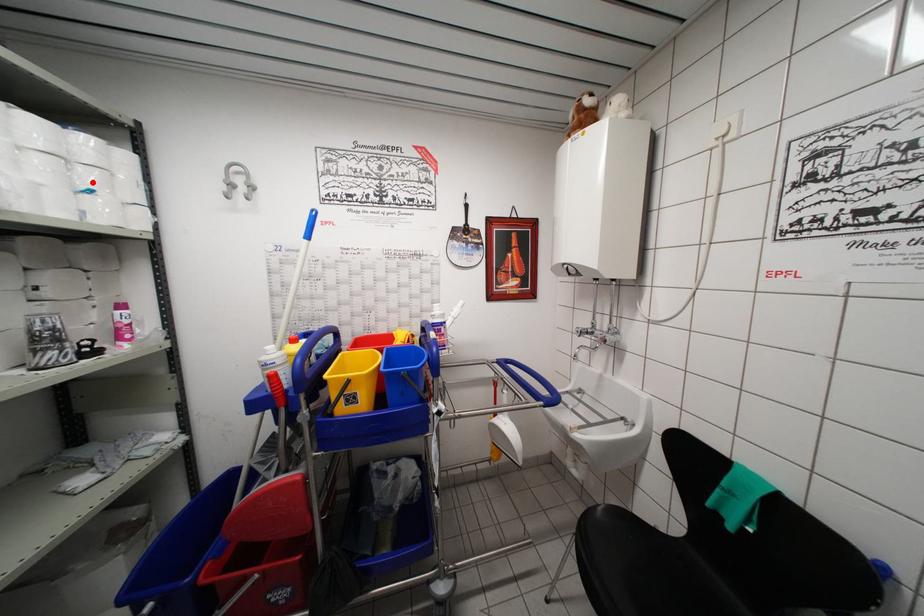
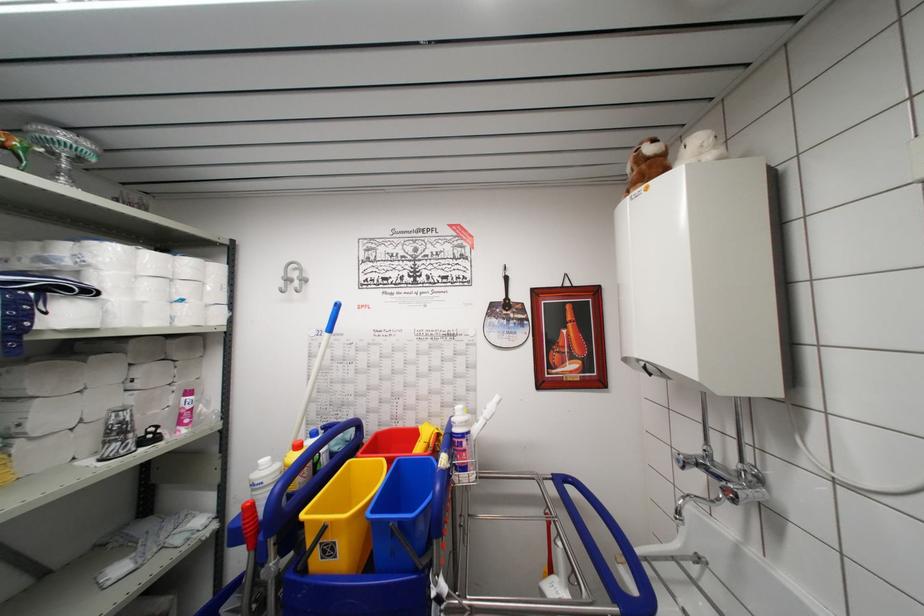
The point at the highlighted location is marked in the first image. Where is the corresponding point in the second image?

(188, 294)